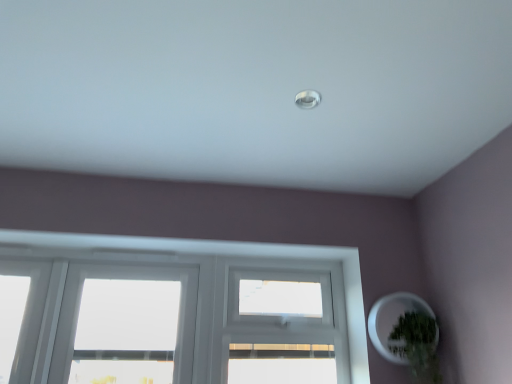
Question: From a real-world perspective, is green matte plant at lower right physically located above or below white matte plant pot at lower right?

Choices:
 (A) below
 (B) above

Answer: (A)

Question: Looking at their shapes, would you say green matte plant at lower right is wider or thinner than white matte plant pot at lower right?

Choices:
 (A) thin
 (B) wide

Answer: (B)

Question: Choose the correct answer: Is green matte plant at lower right inside white matte plant pot at lower right or outside it?

Choices:
 (A) outside
 (B) inside

Answer: (B)

Question: Looking at their shapes, would you say white matte plant pot at lower right is wider or thinner than green matte plant at lower right?

Choices:
 (A) wide
 (B) thin

Answer: (B)

Question: In terms of height, does white matte plant pot at lower right look taller or shorter compared to green matte plant at lower right?

Choices:
 (A) short
 (B) tall

Answer: (A)

Question: Is white matte plant pot at lower right in front of or behind green matte plant at lower right in the image?

Choices:
 (A) front
 (B) behind

Answer: (B)

Question: From a real-world perspective, relative to green matte plant at lower right, is white matte plant pot at lower right vertically above or below?

Choices:
 (A) below
 (B) above

Answer: (B)